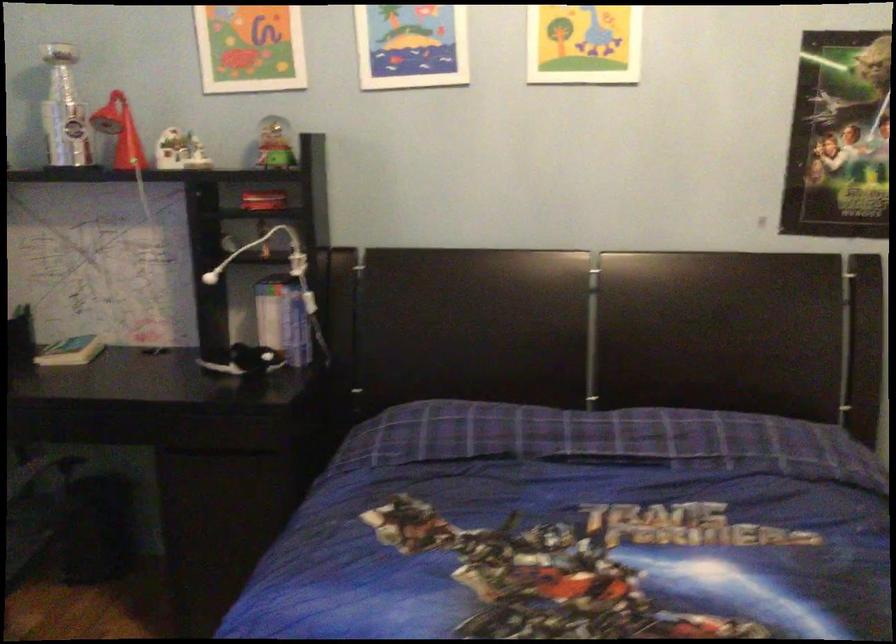
The image size is (896, 644). What do you see at coordinates (440, 431) in the screenshot? I see `the plaid blue pillow` at bounding box center [440, 431].